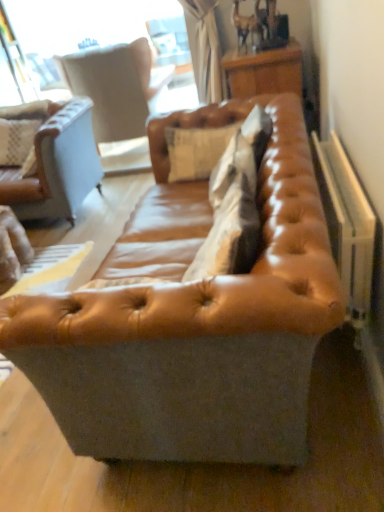
Question: From the image's perspective, would you say light beige leather swivel chair at upper left is positioned over leather cushion at center?

Choices:
 (A) yes
 (B) no

Answer: (A)

Question: Does light beige leather swivel chair at upper left appear on the right side of leather cushion at center?

Choices:
 (A) no
 (B) yes

Answer: (A)

Question: Is leather cushion at center at the back of light beige leather swivel chair at upper left?

Choices:
 (A) yes
 (B) no

Answer: (A)

Question: Considering the relative sizes of light beige leather swivel chair at upper left and leather cushion at center in the image provided, is light beige leather swivel chair at upper left smaller than leather cushion at center?

Choices:
 (A) yes
 (B) no

Answer: (B)

Question: Is light beige leather swivel chair at upper left shorter than leather cushion at center?

Choices:
 (A) yes
 (B) no

Answer: (B)

Question: From the image's perspective, relative to wooden table at upper right, is brown leather couch at left, marked as the 1th studio couch in a left-to-right arrangement, above or below?

Choices:
 (A) above
 (B) below

Answer: (B)

Question: Does point (92, 168) appear closer or farther from the camera than point (248, 74)?

Choices:
 (A) farther
 (B) closer

Answer: (A)

Question: In terms of width, does brown leather couch at left, the second studio couch positioned from the right, look wider or thinner when compared to wooden table at upper right?

Choices:
 (A) wide
 (B) thin

Answer: (B)

Question: In the image, is brown leather couch at left, marked as the 1th studio couch in a left-to-right arrangement, positioned in front of or behind wooden table at upper right?

Choices:
 (A) front
 (B) behind

Answer: (B)

Question: Would you say white plastic radiator at right is to the left or to the right of light beige leather swivel chair at upper left in the picture?

Choices:
 (A) left
 (B) right

Answer: (B)

Question: Considering the positions of white plastic radiator at right and light beige leather swivel chair at upper left in the image, is white plastic radiator at right taller or shorter than light beige leather swivel chair at upper left?

Choices:
 (A) tall
 (B) short

Answer: (B)

Question: From the image's perspective, relative to light beige leather swivel chair at upper left, is white plastic radiator at right above or below?

Choices:
 (A) above
 (B) below

Answer: (B)

Question: From a real-world perspective, is white plastic radiator at right above or below light beige leather swivel chair at upper left?

Choices:
 (A) below
 (B) above

Answer: (A)

Question: From the image's perspective, is leather cushion at center above or below brown leather couch at left, the second studio couch positioned from the right?

Choices:
 (A) below
 (B) above

Answer: (A)

Question: Based on their sizes in the image, would you say leather cushion at center is bigger or smaller than brown leather couch at left, the 2th studio couch from the front?

Choices:
 (A) big
 (B) small

Answer: (B)